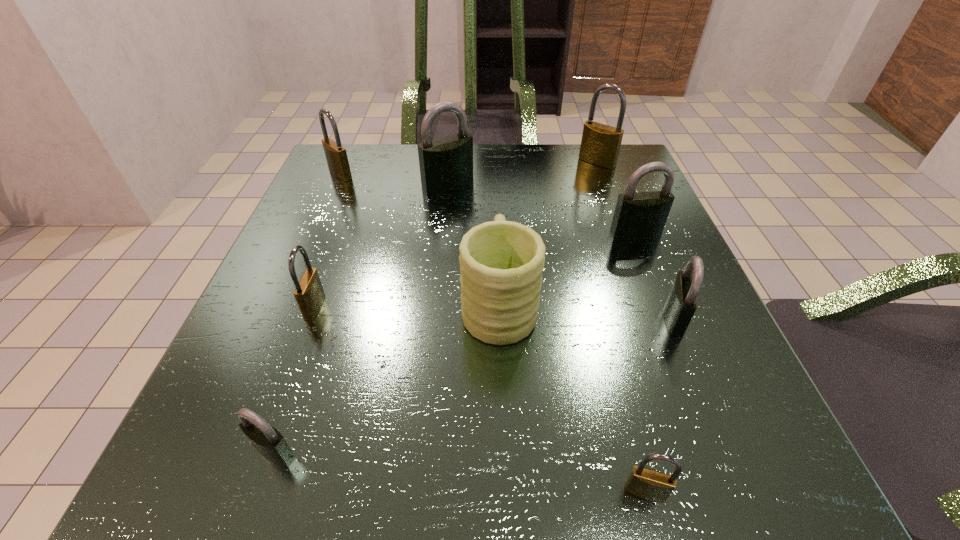
You are a GUI agent. You are given a task and a screenshot of the screen. Output one action in this format:
    pyautogui.click(x=<x>, y=<y>)
    Task: Click on the third farthest black padlock
    
    Given the screenshot: What is the action you would take?
    pyautogui.click(x=682, y=302)

The width and height of the screenshot is (960, 540). I want to click on the nearest black padlock, so click(x=268, y=441).

Identify the location of the second nearest padlock. The image size is (960, 540). (268, 441).

Image resolution: width=960 pixels, height=540 pixels. I want to click on the nearest brass padlock, so click(648, 484).

Where is `the nearest padlock`? The width and height of the screenshot is (960, 540). the nearest padlock is located at coordinates (648, 484).

Identify the location of vacant space situated on the front of the rightmost brass padlock. This screenshot has width=960, height=540. (639, 275).

This screenshot has width=960, height=540. I want to click on free space located 0.380m on the front of the biggest black padlock, so click(433, 334).

I want to click on free space located on the right of the leftmost brass padlock, so click(403, 174).

The height and width of the screenshot is (540, 960). In order to click on blank space located 0.090m on the front of the fifth nearest padlock in this screenshot , I will do `click(652, 273)`.

You are a GUI agent. You are given a task and a screenshot of the screen. Output one action in this format:
    pyautogui.click(x=<x>, y=<y>)
    Task: Click on the free space located 0.140m on the side of the green mug with the handle
    This screenshot has width=960, height=540.
    Given the screenshot: What is the action you would take?
    pyautogui.click(x=495, y=219)